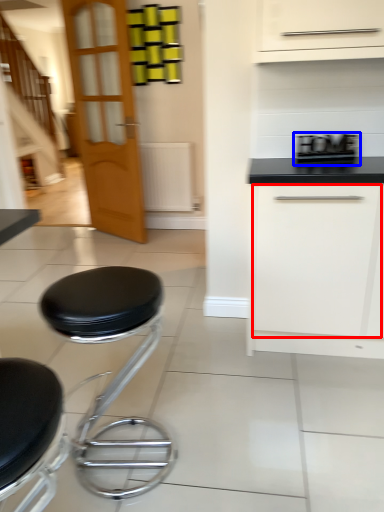
Question: Which of the following is the closest to the observer, drawer (highlighted by a red box) or appliance (highlighted by a blue box)?

Choices:
 (A) drawer
 (B) appliance

Answer: (A)